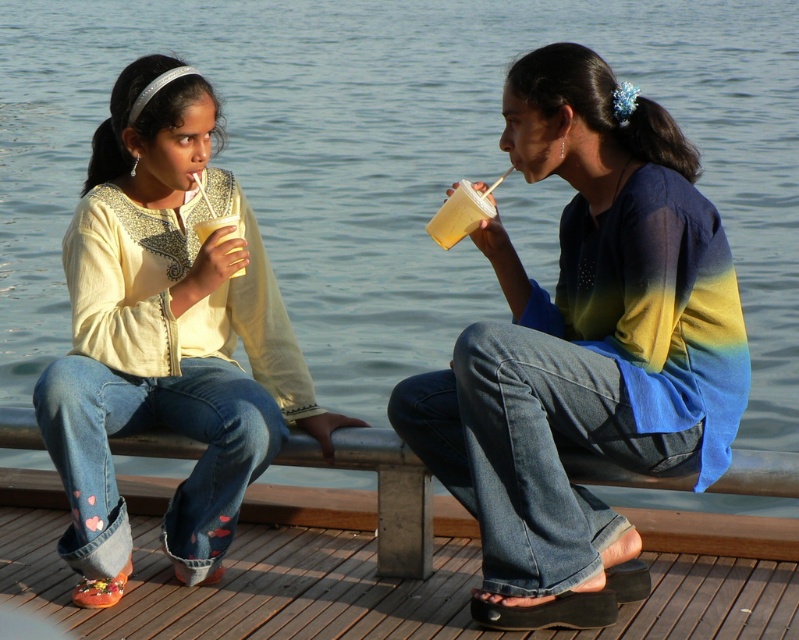
Question: Which object is the closest to the ombre fabric shirt at center?

Choices:
 (A) wooden dock at lower center
 (B) translucent plastic cup at left

Answer: (A)

Question: Is matte yellow shirt at left below wooden dock at lower center?

Choices:
 (A) no
 (B) yes

Answer: (A)

Question: Does wooden dock at lower center appear on the right side of translucent plastic cup at center?

Choices:
 (A) no
 (B) yes

Answer: (A)

Question: Is matte yellow shirt at left positioned in front of translucent plastic cup at left?

Choices:
 (A) no
 (B) yes

Answer: (B)

Question: Which point is closer to the camera taking this photo?

Choices:
 (A) (129, 184)
 (B) (464, 180)
 (C) (233, 221)

Answer: (B)

Question: Which of the following is the farthest from the observer?

Choices:
 (A) (201, 234)
 (B) (431, 225)

Answer: (A)